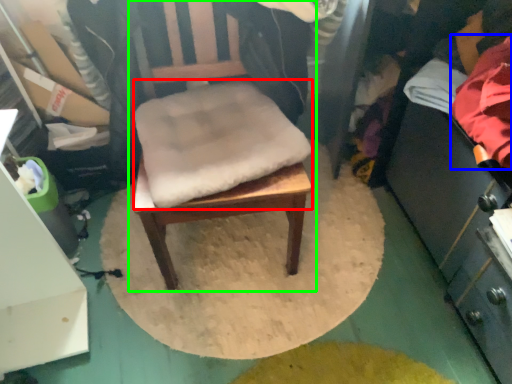
Question: Which object is the closest to the footrest (highlighted by a red box)? Choose among these: clothing (highlighted by a blue box) or chair (highlighted by a green box).

Choices:
 (A) clothing
 (B) chair

Answer: (B)